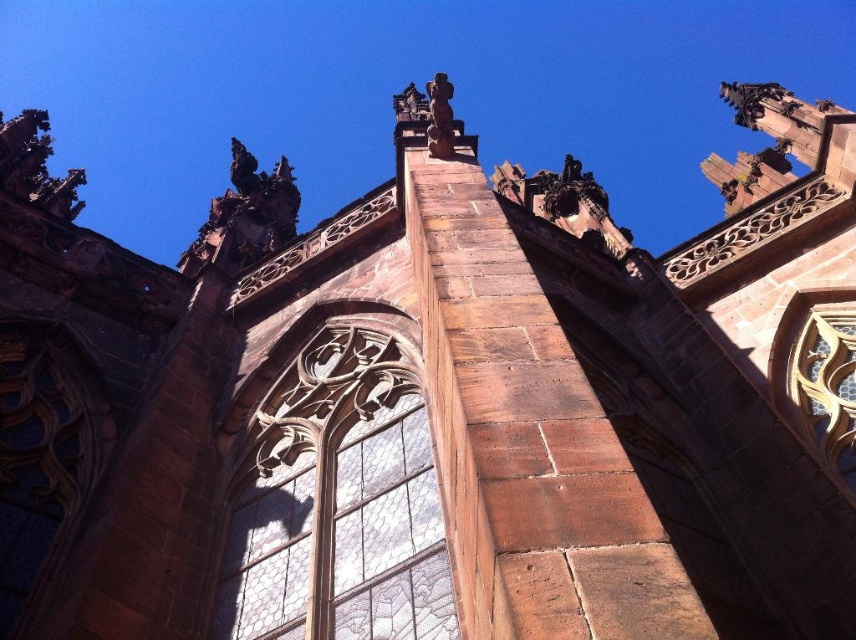
Which is more to the left, clear glass window at center or clear glass window at upper right?

clear glass window at center is more to the left.

Who is higher up, clear glass window at center or clear glass window at upper right?

clear glass window at upper right is higher up.

This screenshot has height=640, width=856. What do you see at coordinates (337, 502) in the screenshot? I see `clear glass window at center` at bounding box center [337, 502].

I want to click on clear glass window at center, so click(x=337, y=502).